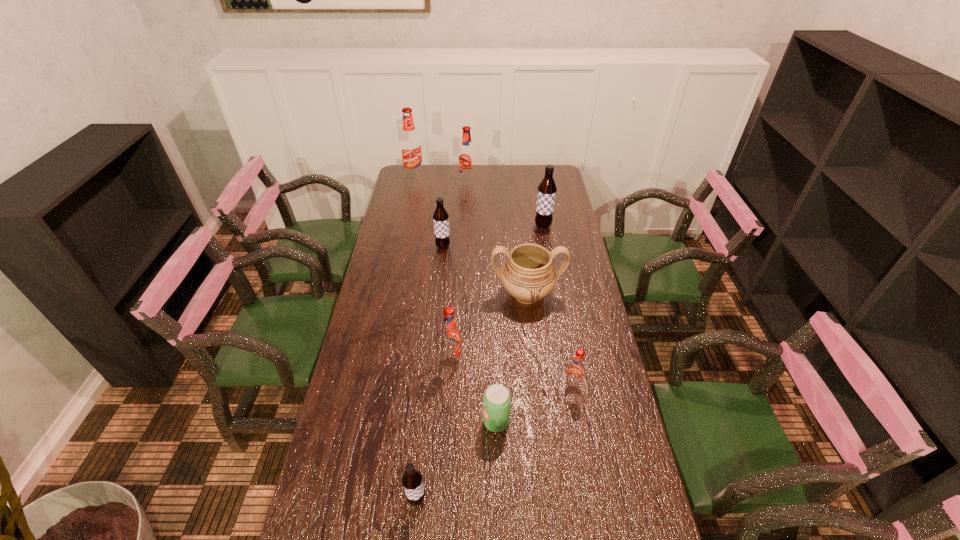
Locate an element on the screen. The height and width of the screenshot is (540, 960). the leftmost object is located at coordinates (410, 143).

Locate an element on the screen. The width and height of the screenshot is (960, 540). the tallest root beer is located at coordinates (410, 143).

The width and height of the screenshot is (960, 540). In order to click on the third smallest red root beer in this screenshot , I will do point(467,169).

The height and width of the screenshot is (540, 960). What are the coordinates of `the fifth nearest root beer` in the screenshot? It's located at (546, 194).

Identify the location of the farthest brown root beer. (546, 194).

Find the location of `the second smallest brown root beer`. the second smallest brown root beer is located at coordinates (440, 216).

I want to click on the second farthest brown root beer, so click(x=440, y=216).

I want to click on the second smallest red root beer, so click(451, 346).

Image resolution: width=960 pixels, height=540 pixels. What are the coordinates of `the third farthest red root beer` in the screenshot? It's located at pyautogui.click(x=451, y=346).

Find the location of `the fifth farthest object`. the fifth farthest object is located at coordinates (529, 274).